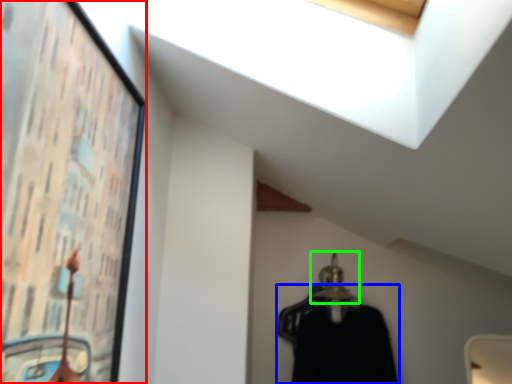
Question: Based on their relative distances, which object is farther from picture frame (highlighted by a red box)? Choose from clothing (highlighted by a blue box) and hanger (highlighted by a green box).

Choices:
 (A) clothing
 (B) hanger

Answer: (B)